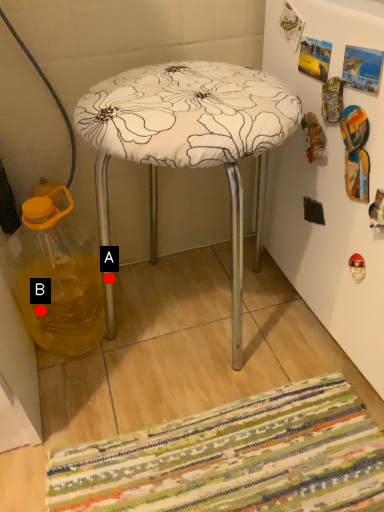
Question: Two points are circled on the image, labeled by A and B beside each circle. Which point is closer to the camera?

Choices:
 (A) A is closer
 (B) B is closer

Answer: (A)